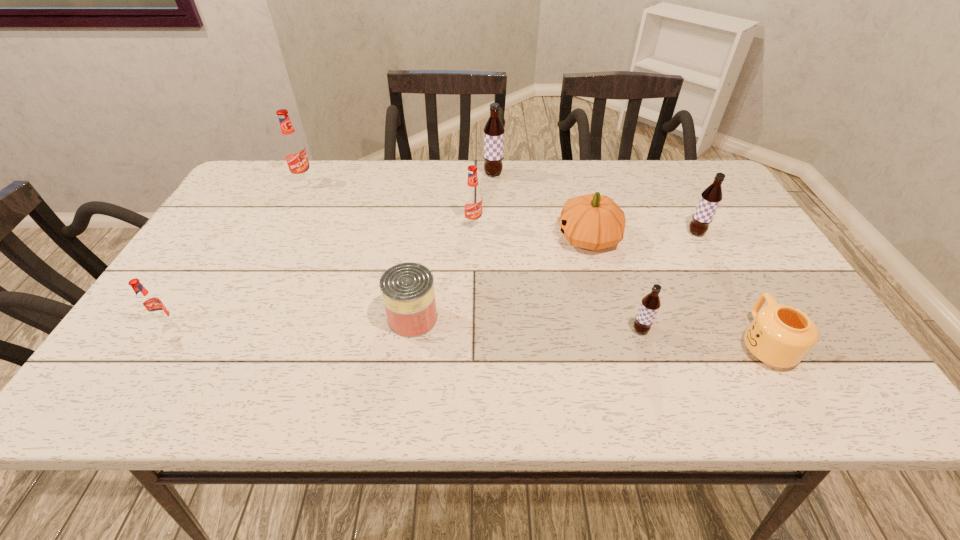
You are a GUI agent. You are given a task and a screenshot of the screen. Output one action in this format:
    pyautogui.click(x=<x>, y=<y>)
    Task: Click on the mug at the right edge
    The width and height of the screenshot is (960, 540).
    Given the screenshot: What is the action you would take?
    pyautogui.click(x=780, y=335)

At what (x,y) coordinates should I click in order to perform the action: click on object that is positioned at the far left corner. Please return your answer as a coordinate pair (x, y). This screenshot has height=540, width=960. Looking at the image, I should click on (293, 148).

Image resolution: width=960 pixels, height=540 pixels. I want to click on object present at the near right corner, so click(780, 335).

In the image, there is a desktop. At what (x,y) coordinates should I click in order to perform the action: click on vacant space at the far edge. Please return your answer as a coordinate pair (x, y). The width and height of the screenshot is (960, 540). Looking at the image, I should click on (372, 196).

Locate an element on the screen. The width and height of the screenshot is (960, 540). blank space at the left edge of the desktop is located at coordinates (230, 237).

Where is `blank area at the right edge`? blank area at the right edge is located at coordinates (749, 286).

At what (x,y) coordinates should I click in order to perform the action: click on free location at the far left corner of the desktop. Please return your answer as a coordinate pair (x, y). This screenshot has height=540, width=960. Looking at the image, I should click on (259, 186).

Find the location of a particular element. This screenshot has height=540, width=960. free space at the near right corner is located at coordinates (814, 374).

This screenshot has height=540, width=960. In order to click on vacant region between the orange gourd and the biggest brown root beer in this screenshot , I will do [540, 206].

Identify the location of free space that is in between the second red root beer from left to right and the leftmost red root beer. Image resolution: width=960 pixels, height=540 pixels. (235, 253).